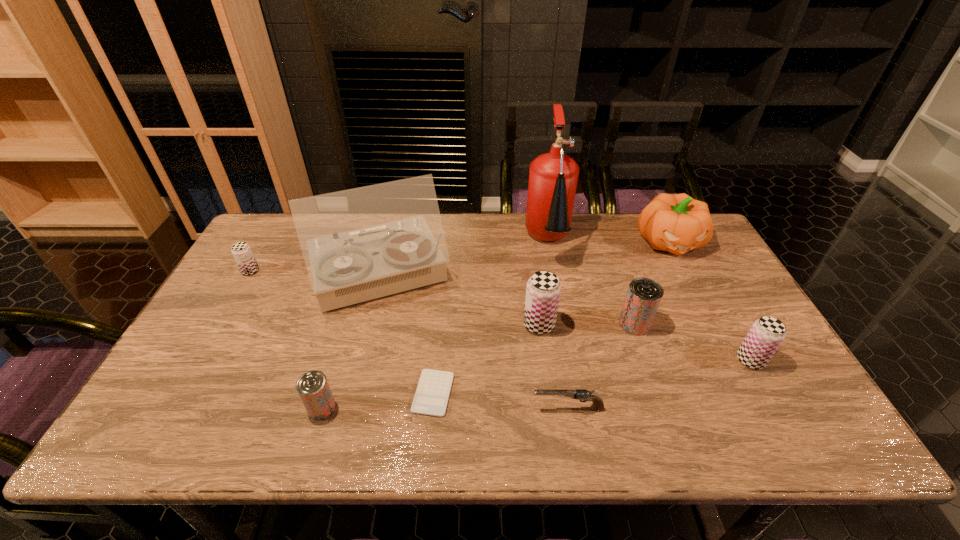
Where is `free space located 0.190m on the carved face of the pumpkin`? The image size is (960, 540). free space located 0.190m on the carved face of the pumpkin is located at coordinates (704, 306).

Find the location of a particular element. Image resolution: width=960 pixels, height=540 pixels. vacant space located on the left of the tallest beer can is located at coordinates (396, 325).

I want to click on free region located 0.160m on the left of the second biggest purple beer can, so click(x=674, y=360).

Locate an element on the screen. This screenshot has height=540, width=960. vacant space located on the front of the right red beer can is located at coordinates (652, 373).

Where is `vacant space situated on the back of the leftmost purple beer can`? This screenshot has width=960, height=540. vacant space situated on the back of the leftmost purple beer can is located at coordinates (283, 215).

Where is `vacant area situated on the right of the smaller red beer can`? The height and width of the screenshot is (540, 960). vacant area situated on the right of the smaller red beer can is located at coordinates (488, 408).

Identify the location of free space located 0.190m aiming along the barrel of the gun. The height and width of the screenshot is (540, 960). (449, 408).

This screenshot has width=960, height=540. I want to click on vacant space positioned 0.400m aiming along the barrel of the gun, so click(x=358, y=408).

I want to click on vacant space located 0.100m aiming along the barrel of the gun, so click(489, 408).

Where is `free space located 0.300m on the back of the shortest object`? free space located 0.300m on the back of the shortest object is located at coordinates (443, 288).